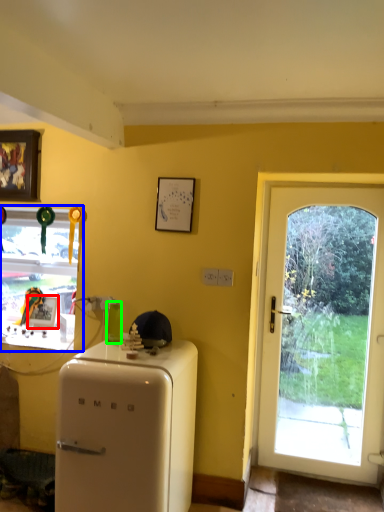
Question: Which object is the farthest from picture frame (highlighted by a red box)? Choose among these: window (highlighted by a blue box) or bottle (highlighted by a green box).

Choices:
 (A) window
 (B) bottle

Answer: (B)